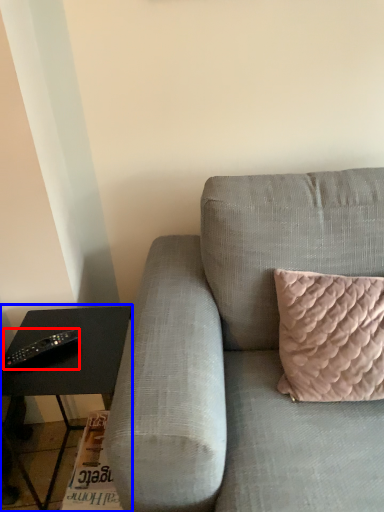
Question: Which of the following is the closest to the observer, remote (highlighted by a red box) or table (highlighted by a blue box)?

Choices:
 (A) remote
 (B) table

Answer: (B)